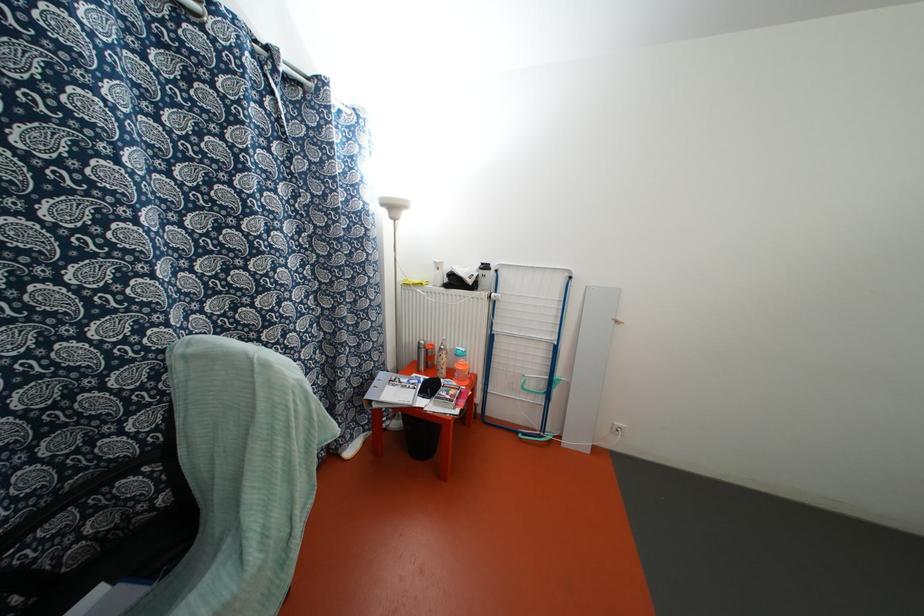
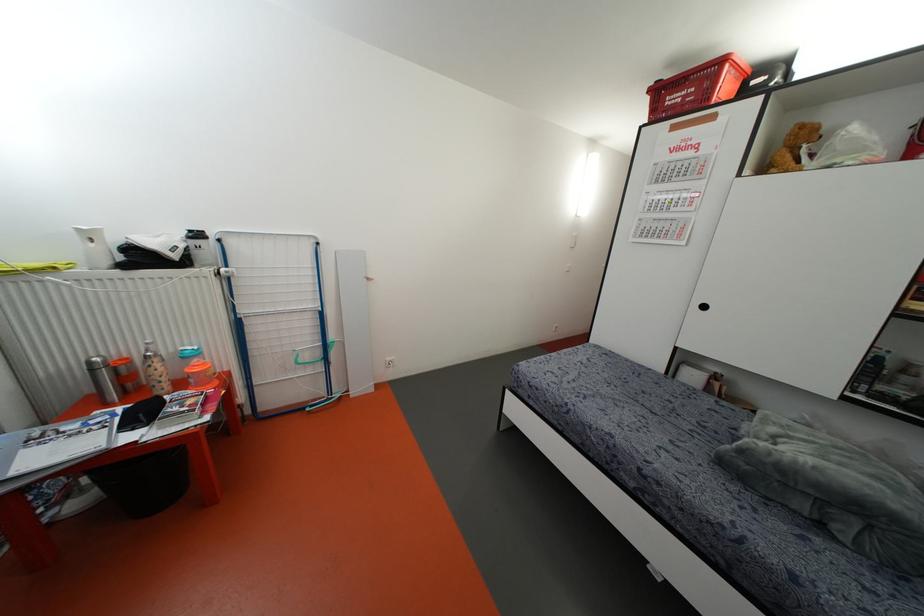
The point at (467, 382) is marked in the first image. Where is the corresponding point in the second image?

(215, 383)